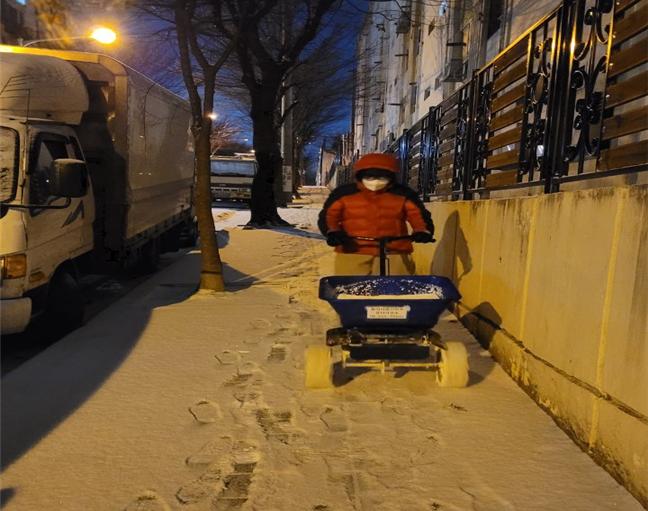
Find the location of a particular element. Image resolution: width=648 pixels, height=511 pixels. wall is located at coordinates (573, 286).